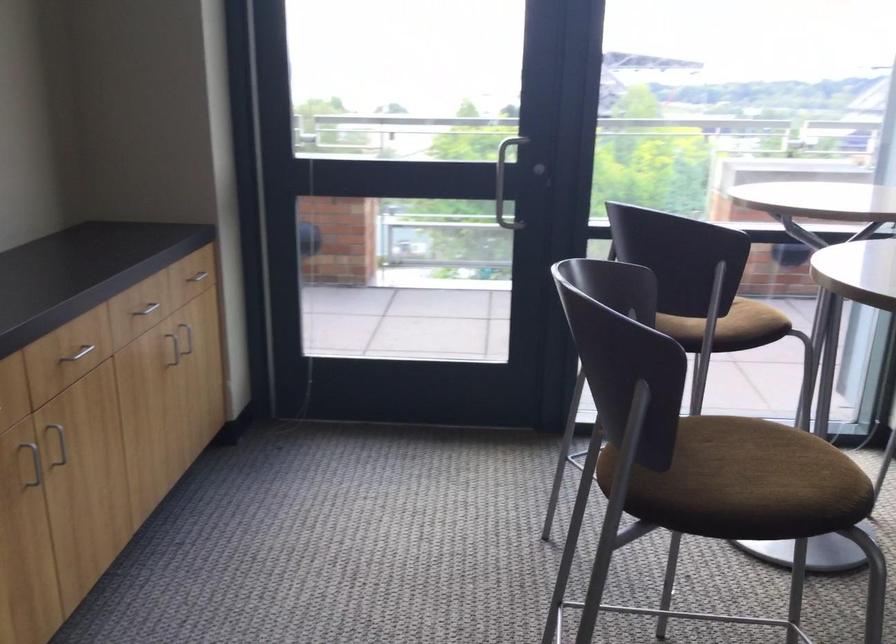
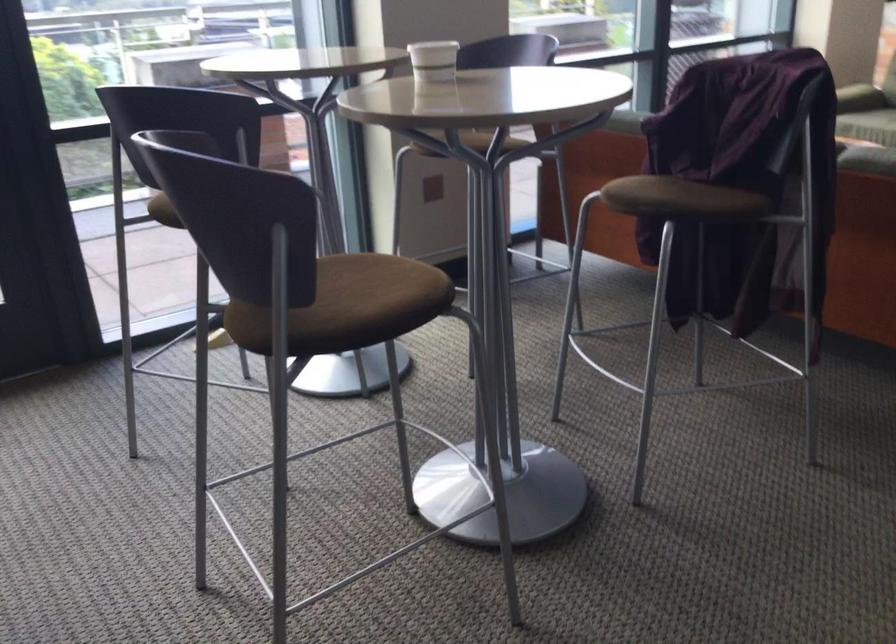
Question: I am providing you with two images of the same scene from different viewpoints. After the viewpoint changes to image2, which objects are now occluded?

Choices:
 (A) blue shoebox
 (B) chair sitting surface
 (C) white paper cup
 (D) brown chair sitting surface

Answer: (B)